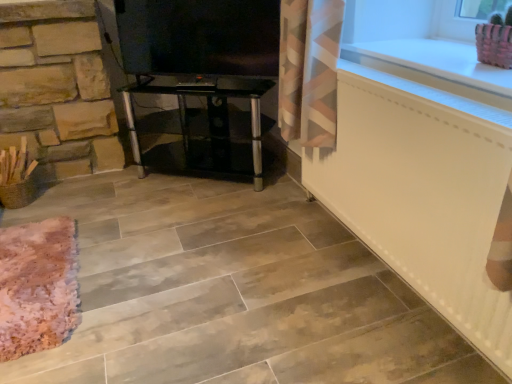
Question: Considering the relative sizes of white matte radiator at lower right and black glass tv stand at center in the image provided, is white matte radiator at lower right bigger than black glass tv stand at center?

Choices:
 (A) no
 (B) yes

Answer: (B)

Question: Is white matte radiator at lower right further to the viewer compared to black glass tv stand at center?

Choices:
 (A) no
 (B) yes

Answer: (A)

Question: Is white matte radiator at lower right located outside black glass tv stand at center?

Choices:
 (A) yes
 (B) no

Answer: (A)

Question: Is white matte radiator at lower right smaller than black glass tv stand at center?

Choices:
 (A) no
 (B) yes

Answer: (A)

Question: Does white matte radiator at lower right lie in front of black glass tv stand at center?

Choices:
 (A) yes
 (B) no

Answer: (A)

Question: Considering the positions of white matte radiator at lower right and pink fabric basket at upper right in the image, is white matte radiator at lower right taller or shorter than pink fabric basket at upper right?

Choices:
 (A) tall
 (B) short

Answer: (A)

Question: From the image's perspective, relative to pink fabric basket at upper right, is white matte radiator at lower right above or below?

Choices:
 (A) below
 (B) above

Answer: (A)

Question: Based on their positions, is white matte radiator at lower right located to the left or right of pink fabric basket at upper right?

Choices:
 (A) right
 (B) left

Answer: (B)

Question: Relative to pink fabric basket at upper right, is white matte radiator at lower right in front or behind?

Choices:
 (A) behind
 (B) front

Answer: (B)

Question: Is pink fabric basket at upper right bigger or smaller than white matte radiator at lower right?

Choices:
 (A) small
 (B) big

Answer: (A)

Question: Is pink fabric basket at upper right inside or outside of white matte radiator at lower right?

Choices:
 (A) inside
 (B) outside

Answer: (B)

Question: Is pink fabric basket at upper right wider or thinner than white matte radiator at lower right?

Choices:
 (A) wide
 (B) thin

Answer: (A)

Question: From the image's perspective, relative to white matte radiator at lower right, is pink fabric basket at upper right above or below?

Choices:
 (A) below
 (B) above

Answer: (B)

Question: Is white matte radiator at lower right bigger or smaller than white glossy counter top at upper right?

Choices:
 (A) big
 (B) small

Answer: (A)

Question: Relative to white glossy counter top at upper right, is white matte radiator at lower right in front or behind?

Choices:
 (A) behind
 (B) front

Answer: (B)